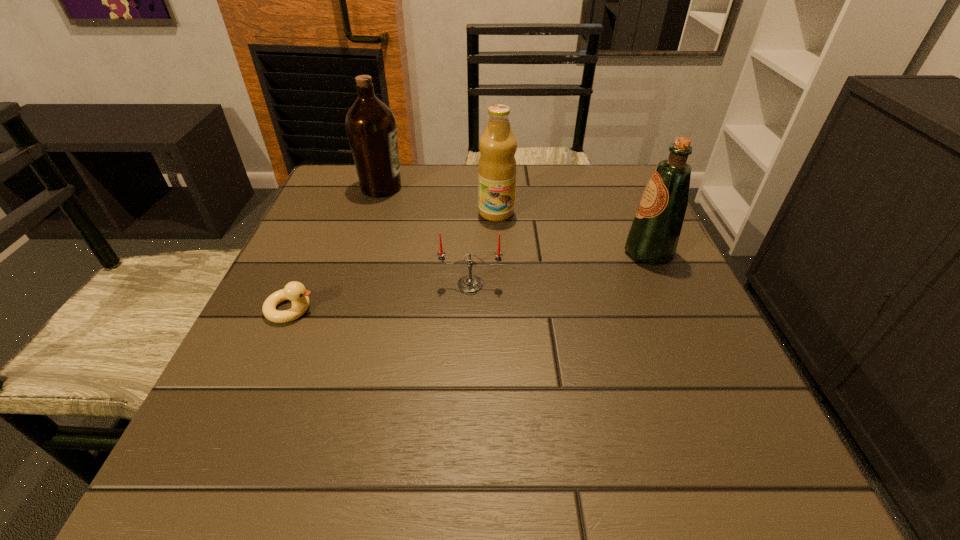
Locate an element on the screen. This screenshot has height=540, width=960. the farthest object is located at coordinates point(371,127).

At what (x,y) coordinates should I click in order to perform the action: click on the leftmost olive oil. Please return your answer as a coordinate pair (x, y). The height and width of the screenshot is (540, 960). Looking at the image, I should click on (371, 127).

Identify the location of the third farthest object. This screenshot has height=540, width=960. (654, 234).

Image resolution: width=960 pixels, height=540 pixels. Find the location of `the nearest olive oil`. the nearest olive oil is located at coordinates (654, 234).

I want to click on the fourth nearest object, so click(497, 167).

Identify the location of the second nearest olive oil. The width and height of the screenshot is (960, 540). (497, 167).

You are a GUI agent. You are given a task and a screenshot of the screen. Output one action in this format:
    pyautogui.click(x=<x>, y=<y>)
    Task: Click on the candle
    Image resolution: width=960 pixels, height=540 pixels.
    Given the screenshot: What is the action you would take?
    pyautogui.click(x=470, y=283)

This screenshot has width=960, height=540. Identify the location of the second shortest object. (470, 283).

You are a GUI agent. You are given a task and a screenshot of the screen. Output one action in this format:
    pyautogui.click(x=<x>, y=<y>)
    Task: Click on the nearest object
    This screenshot has height=540, width=960.
    Given the screenshot: What is the action you would take?
    pyautogui.click(x=295, y=291)

At what (x,y) coordinates should I click in order to perform the action: click on duckling. Please return your answer as a coordinate pair (x, y). The height and width of the screenshot is (540, 960). Looking at the image, I should click on (295, 291).